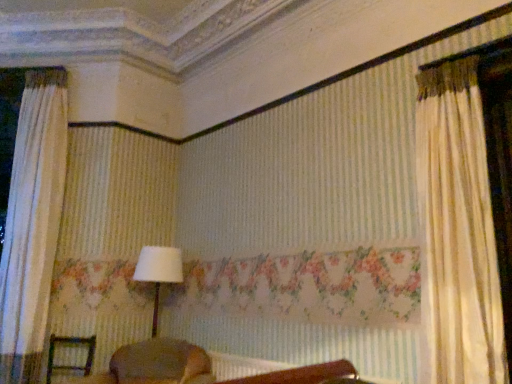
Measure the distance between white fabric lampshade at center and camera.

white fabric lampshade at center and camera are 3.65 meters apart.

This screenshot has height=384, width=512. What are the coordinates of `white fabric lampshade at center` in the screenshot? It's located at (158, 272).

This screenshot has height=384, width=512. What do you see at coordinates (158, 272) in the screenshot? I see `white fabric lampshade at center` at bounding box center [158, 272].

What do you see at coordinates (70, 343) in the screenshot? I see `wooden chair at lower left` at bounding box center [70, 343].

What is the approximate width of wooden chair at lower left?

17.97 inches.

You are a GUI agent. You are given a task and a screenshot of the screen. Output one action in this format:
    pyautogui.click(x=<x>, y=<y>)
    Task: Click on the wooden chair at lower left
    
    Given the screenshot: What is the action you would take?
    pyautogui.click(x=70, y=343)

What is the approximate height of wooden chair at lower left?

16.44 inches.

Where is `white fabric lampshade at center`? The height and width of the screenshot is (384, 512). white fabric lampshade at center is located at coordinates (158, 272).

Is white fabric lampshade at center at the left side of wooden chair at lower left?

No.

Considering the positions of objects white fabric lampshade at center and wooden chair at lower left in the image provided, who is behind, white fabric lampshade at center or wooden chair at lower left?

white fabric lampshade at center is more distant.

Is point (149, 265) closer or farther from the camera than point (49, 373)?

Point (149, 265).

From the image's perspective, is white fabric lampshade at center above or below wooden chair at lower left?

white fabric lampshade at center is above wooden chair at lower left.

From a real-world perspective, is white fabric lampshade at center positioned over wooden chair at lower left based on gravity?

Correct, in the physical world, white fabric lampshade at center is higher than wooden chair at lower left.

Between white fabric lampshade at center and wooden chair at lower left, which one has smaller width?

With smaller width is white fabric lampshade at center.

Is white fabric lampshade at center taller or shorter than wooden chair at lower left?

white fabric lampshade at center is taller than wooden chair at lower left.

Who is bigger, white fabric lampshade at center or wooden chair at lower left?

white fabric lampshade at center is bigger.

Is white fabric lampshade at center surrounding wooden chair at lower left?

No, wooden chair at lower left is not surrounded by white fabric lampshade at center.

Is white fabric lampshade at center next to wooden chair at lower left and touching it?

No, white fabric lampshade at center is not beside wooden chair at lower left.

Is white fabric lampshade at center aimed at wooden chair at lower left?

No.

Can you tell me how much white fabric lampshade at center and wooden chair at lower left differ in facing direction?

0.903 degrees separate the facing orientations of white fabric lampshade at center and wooden chair at lower left.

The width and height of the screenshot is (512, 384). I want to click on table lamp behind the wooden chair at lower left, so click(158, 272).

From the picture: Is wooden chair at lower left to the left of white fabric lampshade at center from the viewer's perspective?

Indeed, wooden chair at lower left is positioned on the left side of white fabric lampshade at center.

In the image, is wooden chair at lower left positioned in front of or behind white fabric lampshade at center?

wooden chair at lower left is in front of white fabric lampshade at center.

Considering the points (69, 339) and (155, 301), which point is in front, point (69, 339) or point (155, 301)?

Positioned in front is point (69, 339).

From the image's perspective, is wooden chair at lower left beneath white fabric lampshade at center?

Indeed, from the image's perspective, wooden chair at lower left is shown beneath white fabric lampshade at center.

From a real-world perspective, is wooden chair at lower left on top of white fabric lampshade at center?

No, from a real-world perspective, wooden chair at lower left is not above white fabric lampshade at center.

Which of these two, wooden chair at lower left or white fabric lampshade at center, is thinner?

white fabric lampshade at center.

Is wooden chair at lower left taller or shorter than white fabric lampshade at center?

wooden chair at lower left is shorter than white fabric lampshade at center.

Considering the relative sizes of wooden chair at lower left and white fabric lampshade at center in the image provided, is wooden chair at lower left bigger than white fabric lampshade at center?

Incorrect, wooden chair at lower left is not larger than white fabric lampshade at center.

Would you say wooden chair at lower left is inside or outside white fabric lampshade at center?

wooden chair at lower left exists outside the volume of white fabric lampshade at center.

Is wooden chair at lower left not close to white fabric lampshade at center?

No, wooden chair at lower left is in close proximity to white fabric lampshade at center.

Is white fabric lampshade at center at the back of wooden chair at lower left?

That's not correct — wooden chair at lower left is not looking away from white fabric lampshade at center.

Identify the location of furniture below the white fabric lampshade at center (from the image's perspective). (70, 343).

Locate an element on the screen. This screenshot has height=384, width=512. furniture in front of the white fabric lampshade at center is located at coordinates (70, 343).

Locate an element on the screen. table lamp behind the wooden chair at lower left is located at coordinates (x=158, y=272).